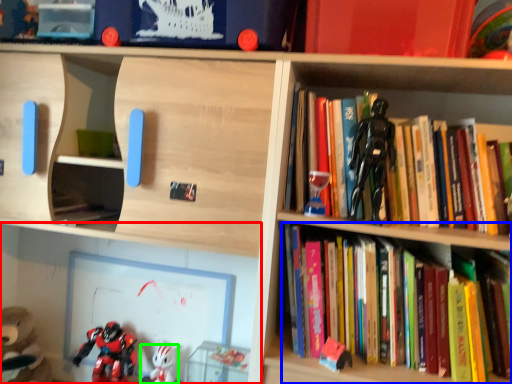
Question: Based on their relative distances, which object is nearer to shelf (highlighted by a red box)? Choose from book (highlighted by a blue box) and toy (highlighted by a green box).

Choices:
 (A) book
 (B) toy

Answer: (B)